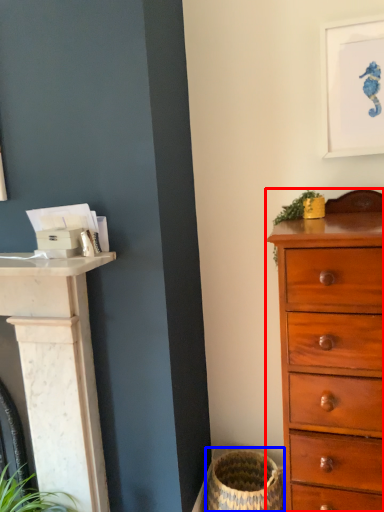
Question: Which point is further to the camera, chest of drawers (highlighted by a red box) or basket container (highlighted by a blue box)?

Choices:
 (A) chest of drawers
 (B) basket container

Answer: (B)